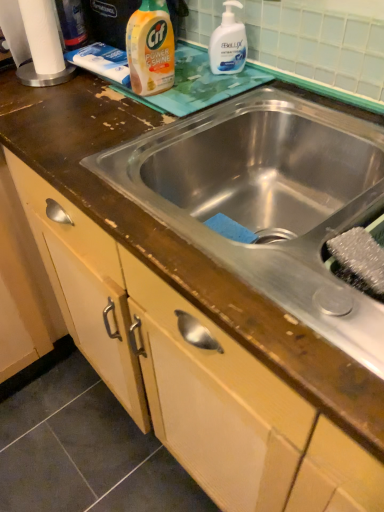
Image resolution: width=384 pixels, height=512 pixels. I want to click on free region on the left part of white glossy hand soap at upper right, which ranks as the second cleaning product in left-to-right order, so click(191, 76).